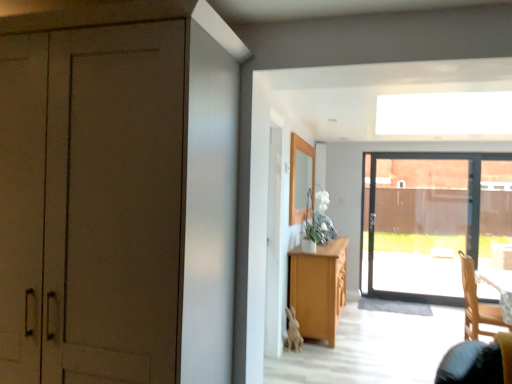
Question: Should I look upward or downward to see matte brown cabinet at left?

Choices:
 (A) down
 (B) up

Answer: (A)

Question: Is wooden chair at lower right to the left of light wood cabinet at center from the viewer's perspective?

Choices:
 (A) yes
 (B) no

Answer: (B)

Question: From the image's perspective, is wooden chair at lower right on light wood cabinet at center?

Choices:
 (A) no
 (B) yes

Answer: (A)

Question: Is wooden chair at lower right directly adjacent to light wood cabinet at center?

Choices:
 (A) yes
 (B) no

Answer: (B)

Question: Considering the relative sizes of wooden chair at lower right and light wood cabinet at center in the image provided, is wooden chair at lower right bigger than light wood cabinet at center?

Choices:
 (A) no
 (B) yes

Answer: (A)

Question: From the image's perspective, is wooden chair at lower right beneath light wood cabinet at center?

Choices:
 (A) yes
 (B) no

Answer: (A)

Question: Is wooden chair at lower right smaller than light wood cabinet at center?

Choices:
 (A) no
 (B) yes

Answer: (B)

Question: Is light wood cabinet at center smaller than matte brown cabinet at left?

Choices:
 (A) no
 (B) yes

Answer: (B)

Question: From a real-world perspective, is light wood cabinet at center located beneath matte brown cabinet at left?

Choices:
 (A) no
 (B) yes

Answer: (B)

Question: Would you say light wood cabinet at center contains matte brown cabinet at left?

Choices:
 (A) no
 (B) yes

Answer: (A)

Question: Considering the relative sizes of light wood cabinet at center and matte brown cabinet at left in the image provided, is light wood cabinet at center taller than matte brown cabinet at left?

Choices:
 (A) yes
 (B) no

Answer: (B)

Question: Is light wood cabinet at center aimed at matte brown cabinet at left?

Choices:
 (A) no
 (B) yes

Answer: (A)

Question: Is light wood cabinet at center not inside matte brown cabinet at left?

Choices:
 (A) no
 (B) yes

Answer: (B)

Question: Does matte brown cabinet at left appear on the right side of light wood cabinet at center?

Choices:
 (A) no
 (B) yes

Answer: (A)